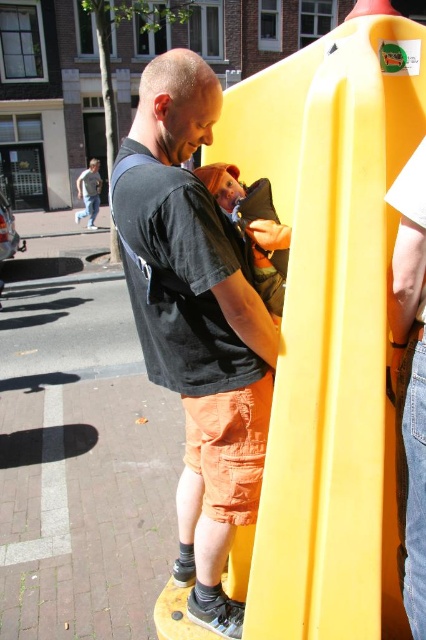
Which is above, matte black shirt at center or fluffy brown teddy bear at center?

Positioned higher is fluffy brown teddy bear at center.

Identify the location of matte black shirt at center. (195, 321).

This screenshot has width=426, height=640. I want to click on matte black shirt at center, so click(195, 321).

Which is more to the right, yellow plastic slide at center or fluffy brown teddy bear at center?

From the viewer's perspective, yellow plastic slide at center appears more on the right side.

The height and width of the screenshot is (640, 426). What do you see at coordinates (330, 324) in the screenshot?
I see `yellow plastic slide at center` at bounding box center [330, 324].

The height and width of the screenshot is (640, 426). What do you see at coordinates (330, 324) in the screenshot? I see `yellow plastic slide at center` at bounding box center [330, 324].

I want to click on yellow plastic slide at center, so click(x=330, y=324).

Who is higher up, yellow plastic slide at center or matte black shirt at center?

yellow plastic slide at center is higher up.

Between point (307, 337) and point (138, 275), which one is positioned behind?

Point (138, 275)

Image resolution: width=426 pixels, height=640 pixels. Find the location of `yellow plastic slide at center`. yellow plastic slide at center is located at coordinates (330, 324).